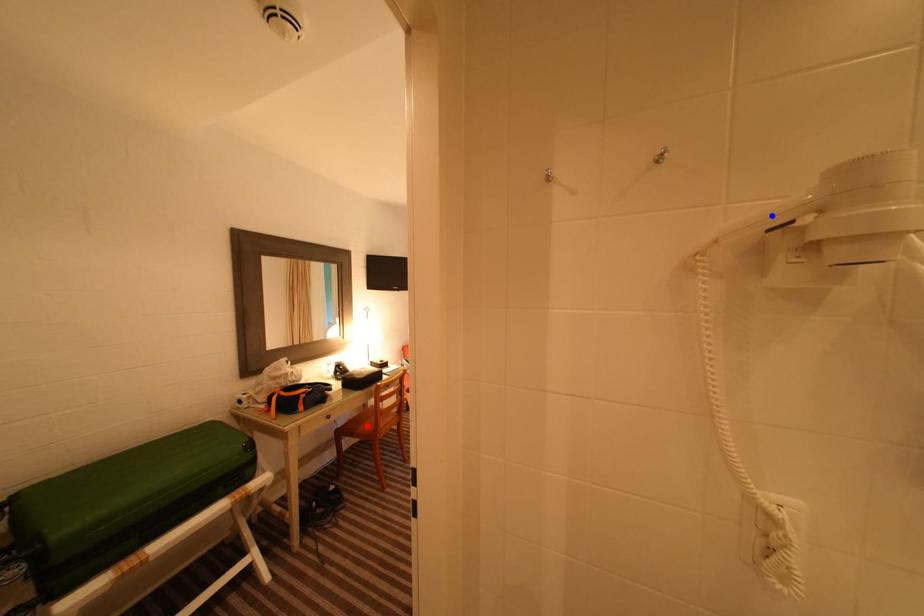
Question: In the image, two points are highlighted. Which point is nearer to the camera? Reply with the corresponding letter.

Choices:
 (A) blue point
 (B) red point

Answer: (A)